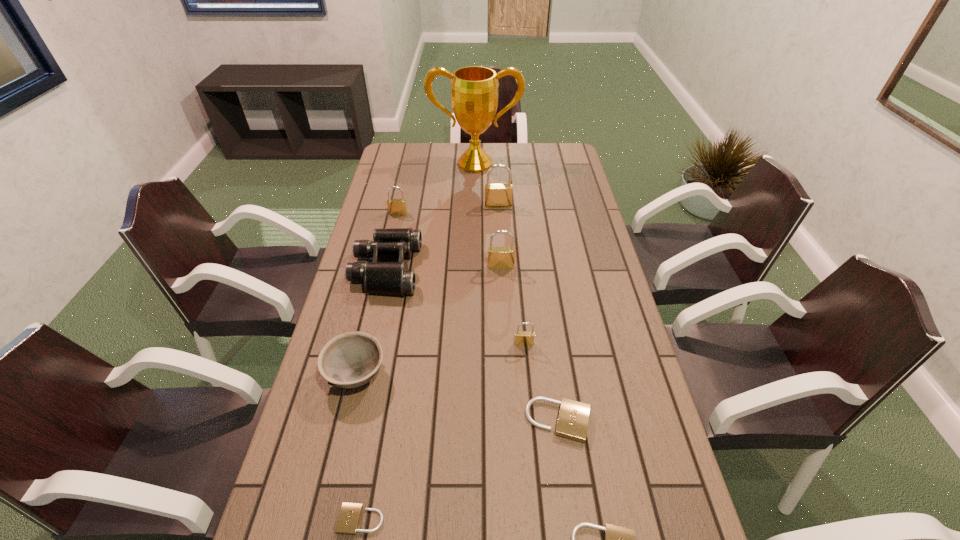
Find the location of a particular element. free region at the left edge of the desktop is located at coordinates (368, 224).

I want to click on vacant region at the right edge of the desktop, so click(x=662, y=472).

Locate an element on the screen. The image size is (960, 540). free space at the far left corner of the desktop is located at coordinates (417, 158).

Where is `free space between the ninth shortest object and the award`? The height and width of the screenshot is (540, 960). free space between the ninth shortest object and the award is located at coordinates (487, 185).

This screenshot has height=540, width=960. In order to click on free spot between the binoculars and the gold award in this screenshot , I will do `click(431, 216)`.

At what (x,y) coordinates should I click in order to perform the action: click on vacant region between the biggest brass padlock and the second nearest brass padlock. Please return your answer as a coordinate pair (x, y). Looking at the image, I should click on (499, 236).

The height and width of the screenshot is (540, 960). I want to click on vacant space that is in between the gray bowl and the smallest brass padlock, so click(x=440, y=359).

The width and height of the screenshot is (960, 540). In order to click on vacant area between the gold award and the smallest beige padlock in this screenshot , I will do `click(419, 341)`.

Locate an element on the screen. This screenshot has width=960, height=540. free space that is in between the fifth nearest padlock and the fourth nearest padlock is located at coordinates (513, 305).

Where is `empty location between the smallest brass padlock and the third tallest object`? The image size is (960, 540). empty location between the smallest brass padlock and the third tallest object is located at coordinates (513, 305).